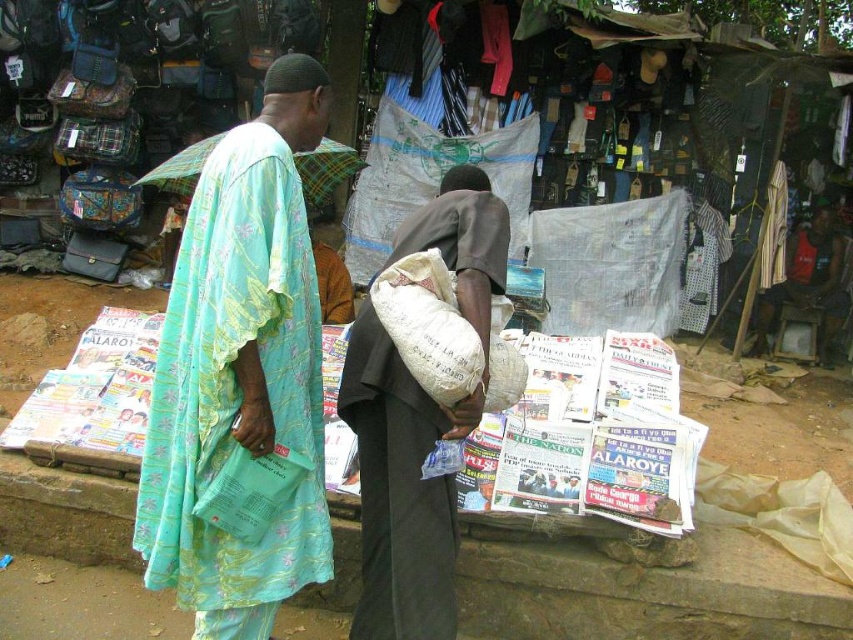
You are a vendor at the market and need to place a new item between the light blue floral fabric robe at left and the dark brown fabric bag at center. Based on their widths, which object should be placed closer to the center to maintain balance?

The light blue floral fabric robe at left is wider than the dark brown fabric bag at center, so placing the new item closer to the center near the dark brown fabric bag at center would help balance the arrangement.

You are a customer at the market and want to place an item between the dark brown fabric bag at center and the striped fabric shirt at center. Where should you place it?

The dark brown fabric bag at center is positioned on the left side of striped fabric shirt at center, so you should place the item between them by putting it to the right of the dark brown fabric bag at center and to the left of the striped fabric shirt at center.

You are a customer at the market and you want to pick up the dark brown fabric bag at center and the striped fabric shirt at center. Which one is closer to you?

The dark brown fabric bag at center is closer to you because it is in front of the striped fabric shirt at center.